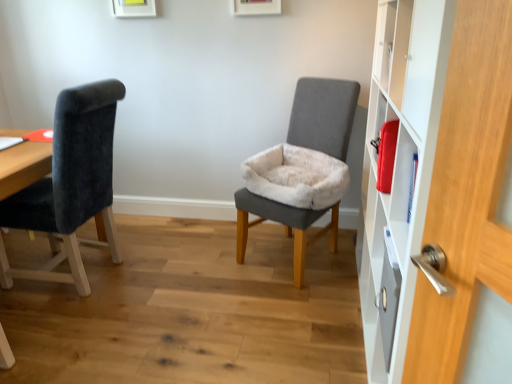
What do you see at coordinates (433, 176) in the screenshot? I see `white matte cabinet at right` at bounding box center [433, 176].

Image resolution: width=512 pixels, height=384 pixels. What are the coordinates of `white matte cabinet at right` in the screenshot? It's located at (433, 176).

Is velvet black chair at left, which is the 2th chair in right-to-left order, at the right side of white matte cabinet at right?

In fact, velvet black chair at left, which is the 2th chair in right-to-left order, is to the left of white matte cabinet at right.

Which object is further away from the camera taking this photo, velvet black chair at left, which is the 2th chair in right-to-left order, or white matte cabinet at right?

velvet black chair at left, which is the 2th chair in right-to-left order.

Is point (63, 192) farther from viewer compared to point (391, 291)?

That is True.

Can you confirm if velvet black chair at left, marked as the first chair in a left-to-right arrangement, is taller than white matte cabinet at right?

No, velvet black chair at left, marked as the first chair in a left-to-right arrangement, is not taller than white matte cabinet at right.

Would you say velvet black chair at left, which is the 2th chair in right-to-left order, is outside gray fabric chair at center, which is the 2th chair from left to right?

Yes, velvet black chair at left, which is the 2th chair in right-to-left order, is not within gray fabric chair at center, which is the 2th chair from left to right.

The image size is (512, 384). I want to click on chair on the left of gray fabric chair at center, which is the 1th chair from right to left, so click(70, 185).

Is there a large distance between velvet black chair at left, marked as the first chair in a left-to-right arrangement, and gray fabric chair at center, which is the 1th chair from right to left?

Indeed, velvet black chair at left, marked as the first chair in a left-to-right arrangement, is not near gray fabric chair at center, which is the 1th chair from right to left.

Between velvet black chair at left, which is the 2th chair in right-to-left order, and gray fabric chair at center, which is the 2th chair from left to right, which one appears on the right side from the viewer's perspective?

Positioned to the right is gray fabric chair at center, which is the 2th chair from left to right.

Relative to velvet black chair at left, marked as the first chair in a left-to-right arrangement, is gray fabric chair at center, which is the 2th chair from left to right, in front or behind?

Visually, gray fabric chair at center, which is the 2th chair from left to right, is located behind velvet black chair at left, marked as the first chair in a left-to-right arrangement.

How different are the orientations of gray fabric chair at center, which is the 1th chair from right to left, and velvet black chair at left, which is the 2th chair in right-to-left order, in degrees?

The angle between the facing direction of gray fabric chair at center, which is the 1th chair from right to left, and the facing direction of velvet black chair at left, which is the 2th chair in right-to-left order, is 61.6 degrees.

Would you say gray fabric chair at center, which is the 1th chair from right to left, is outside velvet black chair at left, marked as the first chair in a left-to-right arrangement?

Yes, gray fabric chair at center, which is the 1th chair from right to left, is located beyond the bounds of velvet black chair at left, marked as the first chair in a left-to-right arrangement.

Is gray fabric chair at center, which is the 2th chair from left to right, facing towards velvet black chair at left, which is the 2th chair in right-to-left order?

No.

From a real-world perspective, is white matte cabinet at right above or below velvet black chair at left, which is the 2th chair in right-to-left order?

From a real-world perspective, white matte cabinet at right is physically above velvet black chair at left, which is the 2th chair in right-to-left order.

Is white matte cabinet at right wider than velvet black chair at left, marked as the first chair in a left-to-right arrangement?

Incorrect, the width of white matte cabinet at right does not surpass that of velvet black chair at left, marked as the first chair in a left-to-right arrangement.

Consider the image. Visually, is white matte cabinet at right positioned to the left or to the right of velvet black chair at left, which is the 2th chair in right-to-left order?

From the image, it's evident that white matte cabinet at right is to the right of velvet black chair at left, which is the 2th chair in right-to-left order.

Is point (360, 260) farther from camera compared to point (70, 169)?

That is True.

Is white matte cabinet at right surrounded by gray fabric chair at center, which is the 1th chair from right to left?

No, white matte cabinet at right is not a part of gray fabric chair at center, which is the 1th chair from right to left.

From a real-world perspective, who is located higher, gray fabric chair at center, which is the 2th chair from left to right, or white matte cabinet at right?

white matte cabinet at right, from a real-world perspective.

Is the surface of gray fabric chair at center, which is the 2th chair from left to right, in direct contact with white matte cabinet at right?

No.

Is white matte cabinet at right located outside gray fabric chair at center, which is the 2th chair from left to right?

That's correct, white matte cabinet at right is outside of gray fabric chair at center, which is the 2th chair from left to right.

Based on their sizes in the image, would you say white matte cabinet at right is bigger or smaller than gray fabric chair at center, which is the 2th chair from left to right?

In the image, white matte cabinet at right appears to be larger than gray fabric chair at center, which is the 2th chair from left to right.

Is white matte cabinet at right further to the viewer compared to gray fabric chair at center, which is the 2th chair from left to right?

No, white matte cabinet at right is closer to the viewer.

Image resolution: width=512 pixels, height=384 pixels. What are the coordinates of `dresser above the velvet black chair at left, marked as the first chair in a left-to-right arrangement (from a real-world perspective)` in the screenshot? It's located at (433, 176).

This screenshot has width=512, height=384. I want to click on chair on the right of velvet black chair at left, which is the 2th chair in right-to-left order, so click(x=323, y=115).

From the image, which object appears to be nearer to white matte cabinet at right, velvet black chair at left, marked as the first chair in a left-to-right arrangement, or gray fabric chair at center, which is the 1th chair from right to left?

gray fabric chair at center, which is the 1th chair from right to left, is closer to white matte cabinet at right.

From the image, which object appears to be nearer to gray fabric chair at center, which is the 2th chair from left to right, white matte cabinet at right or velvet black chair at left, marked as the first chair in a left-to-right arrangement?

white matte cabinet at right is closer to gray fabric chair at center, which is the 2th chair from left to right.

When comparing their distances from velvet black chair at left, which is the 2th chair in right-to-left order, does white matte cabinet at right or gray fabric chair at center, which is the 1th chair from right to left, seem closer?

The object closer to velvet black chair at left, which is the 2th chair in right-to-left order, is gray fabric chair at center, which is the 1th chair from right to left.

From the picture: Looking at the image, which one is located closer to white matte cabinet at right, gray fabric chair at center, which is the 1th chair from right to left, or velvet black chair at left, marked as the first chair in a left-to-right arrangement?

Based on the image, gray fabric chair at center, which is the 1th chair from right to left, appears to be nearer to white matte cabinet at right.

Which object lies nearer to the anchor point velvet black chair at left, marked as the first chair in a left-to-right arrangement, gray fabric chair at center, which is the 2th chair from left to right, or white matte cabinet at right?

gray fabric chair at center, which is the 2th chair from left to right, lies closer to velvet black chair at left, marked as the first chair in a left-to-right arrangement, than the other object.

Looking at the image, which one is located closer to gray fabric chair at center, which is the 2th chair from left to right, velvet black chair at left, which is the 2th chair in right-to-left order, or white matte cabinet at right?

white matte cabinet at right is closer to gray fabric chair at center, which is the 2th chair from left to right.

You are a GUI agent. You are given a task and a screenshot of the screen. Output one action in this format:
    pyautogui.click(x=<x>, y=<y>)
    Task: Click on the chair situated between velvet black chair at left, which is the 2th chair in right-to-left order, and white matte cabinet at right from left to right
    
    Given the screenshot: What is the action you would take?
    pyautogui.click(x=323, y=115)